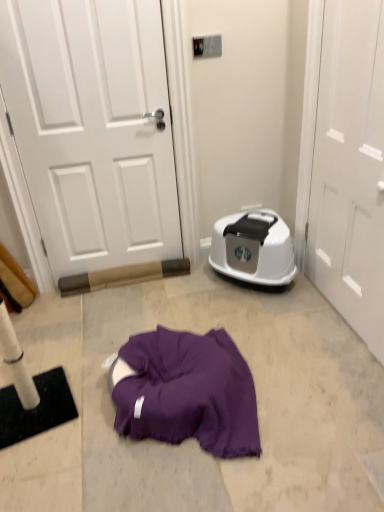
Question: From a real-world perspective, is white glossy dishwasher at right positioned above or below white glossy door at right, the second door from the left?

Choices:
 (A) above
 (B) below

Answer: (B)

Question: From the image's perspective, is white glossy dishwasher at right above or below white glossy door at right, the first door in the right-to-left sequence?

Choices:
 (A) above
 (B) below

Answer: (B)

Question: Based on their relative distances, which object is nearer to the white glossy dishwasher at right?

Choices:
 (A) white matte door at upper left, which is counted as the 1th door, starting from the left
 (B) white glossy door at right, the first door in the right-to-left sequence

Answer: (B)

Question: Estimate the real-world distances between objects in this image. Which object is closer to the white glossy door at right, the second door from the left?

Choices:
 (A) white glossy dishwasher at right
 (B) white matte door at upper left, which is the 2th door from right to left

Answer: (A)